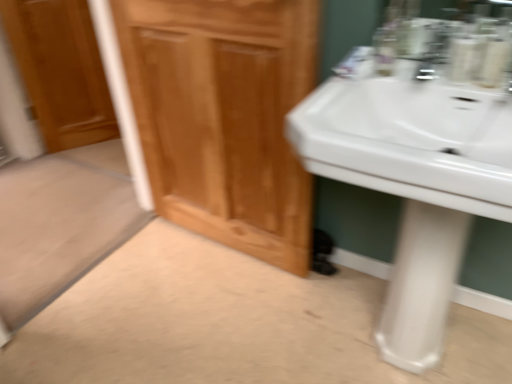
Locate an element on the screen. This screenshot has width=512, height=384. free space on the front side of wooden cabinet at center is located at coordinates (218, 315).